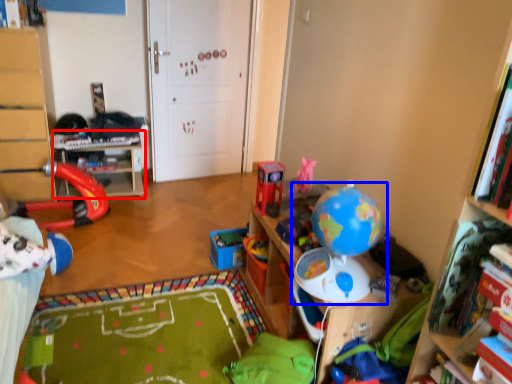
Question: Which object is further to the camera taking this photo, table (highlighted by a red box) or toy (highlighted by a blue box)?

Choices:
 (A) table
 (B) toy

Answer: (A)